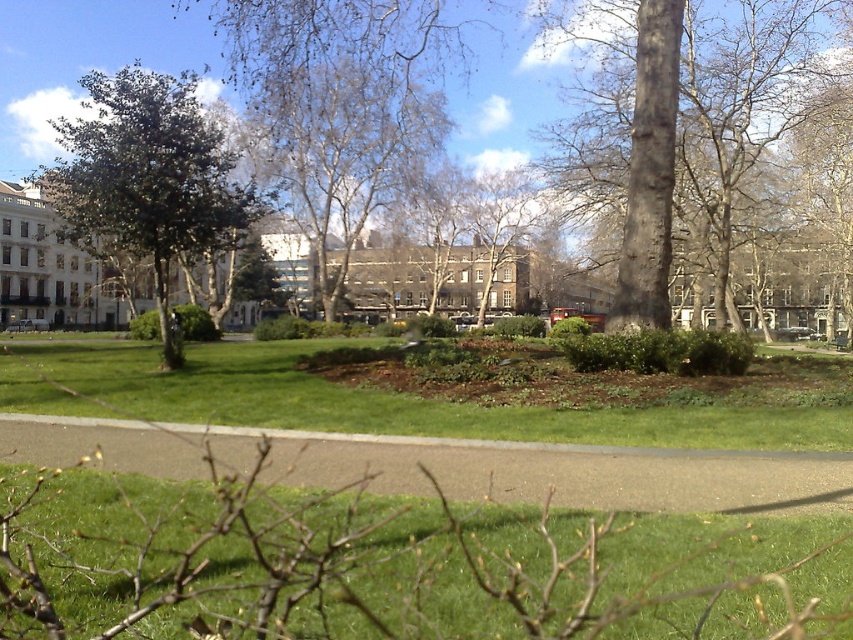
You are a gardener standing on the paved pathway in the middle of the image. You need to reach both the green grassy area at center and the circular flower bed with dark soil and small shrubs or plants at its center. Which area is closer to you?

The green grassy area at center is closer to you since it is only 8.62 meters away from the paved pathway in the middle of the image.

You are standing at the center of the paved pathway in the urban park. Looking towards the lower center, can you see the green grass at lower center? Please explain your reasoning based on its position.

Yes, the green grass at lower center is located at point (403, 564), which would be visible from the center of the paved pathway since it is positioned in the lower central area of the frame.

Consider the image. You are a park maintenance worker needing to water the green grass at lower center and the bare white tree at center. Your water tank can hold enough water to cover an area within a 30 meter radius. Starting from your current position, can you water both areas without needing to refill your tank?

The distance between the green grass at lower center and the bare white tree at center is 29.53 meters. Since this distance is within the 30 meter radius capacity of your water tank, you can water both areas without needing to refill.